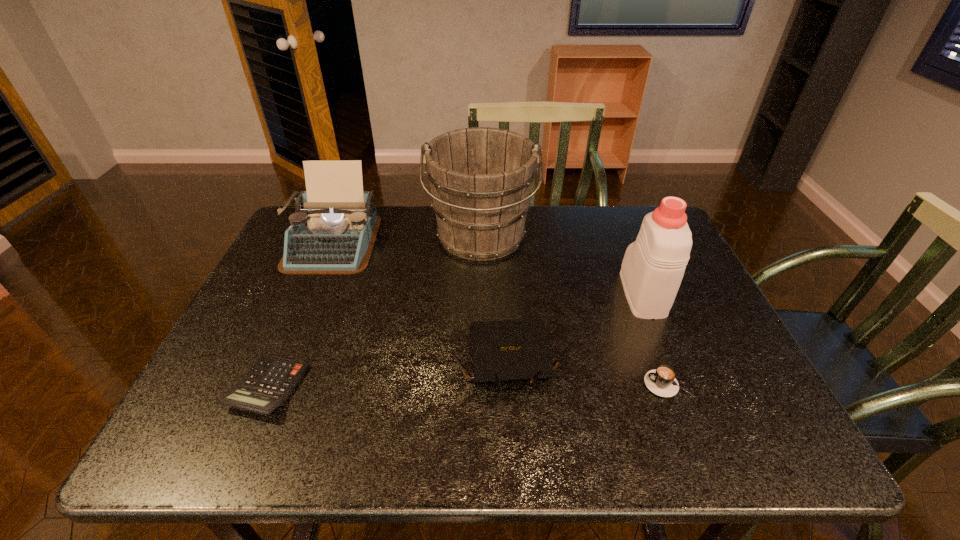
Image resolution: width=960 pixels, height=540 pixels. Find the location of `vacant area situated on the typing side of the typewriter`. vacant area situated on the typing side of the typewriter is located at coordinates tap(300, 320).

What are the coordinates of `vacant space located on the back of the router` in the screenshot? It's located at (501, 232).

Find the location of a particular element. The height and width of the screenshot is (540, 960). vacant space situated with the handle on the side of the cappuccino is located at coordinates (607, 384).

Find the location of a particular element. free space located with the handle on the side of the cappuccino is located at coordinates (574, 384).

Image resolution: width=960 pixels, height=540 pixels. Identify the location of vacant space situated 0.280m with the handle on the side of the cappuccino. (513, 384).

Where is `free spot located 0.110m on the right of the calculator`? free spot located 0.110m on the right of the calculator is located at coordinates (354, 388).

Identify the location of bucket that is positioned at the far edge. The width and height of the screenshot is (960, 540). [481, 178].

Find the location of a particular element. The width and height of the screenshot is (960, 540). typewriter located at the far edge is located at coordinates (333, 231).

I want to click on object at the near edge, so click(268, 384).

Where is `typewriter that is at the left edge`? typewriter that is at the left edge is located at coordinates (333, 231).